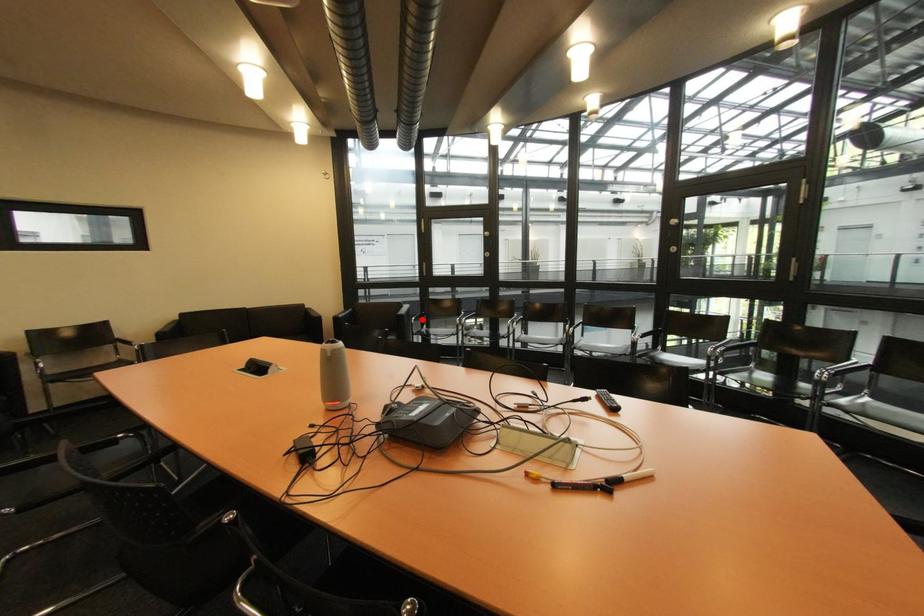
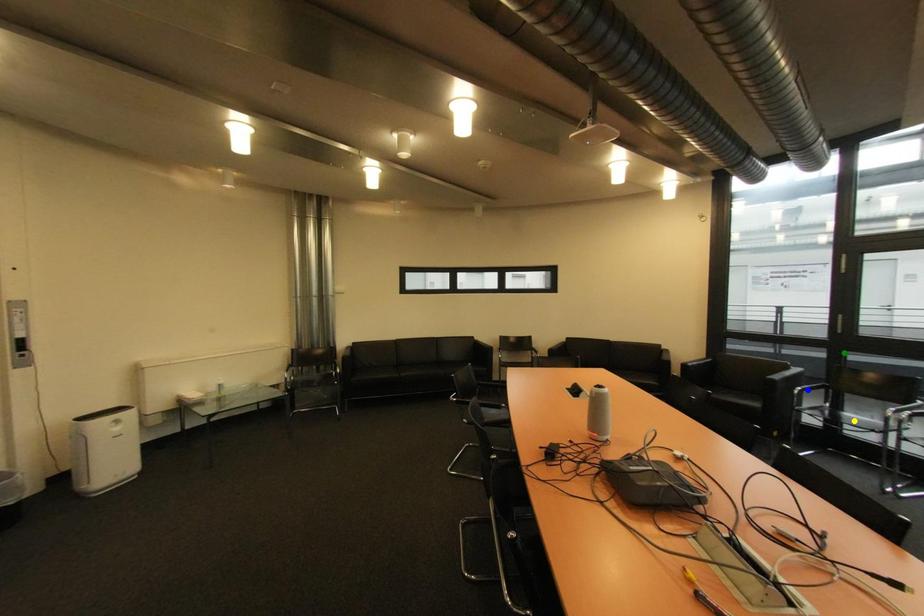
Question: I am providing you with two images of the same scene from different viewpoints. A red point is marked on the first image. You are given multiple points on the second image. Can you choose the point in image 2 that corresponds to the point in image 1?

Choices:
 (A) blue point
 (B) green point
 (C) yellow point

Answer: (A)